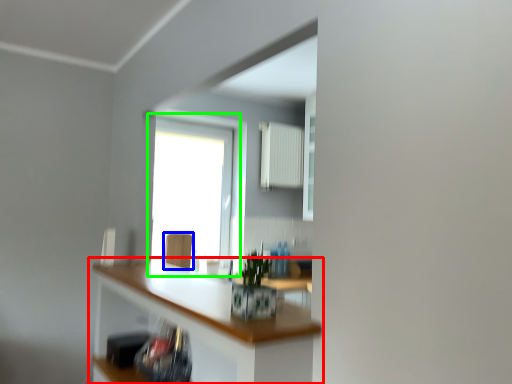
Question: Considering the real-world distances, which object is farthest from countertop (highlighted by a red box)? swivel chair (highlighted by a blue box) or window (highlighted by a green box)?

Choices:
 (A) swivel chair
 (B) window

Answer: (B)